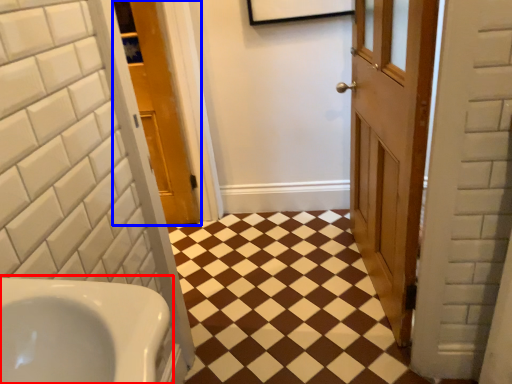
Question: Among these objects, which one is farthest to the camera, sink (highlighted by a red box) or door (highlighted by a blue box)?

Choices:
 (A) sink
 (B) door

Answer: (B)